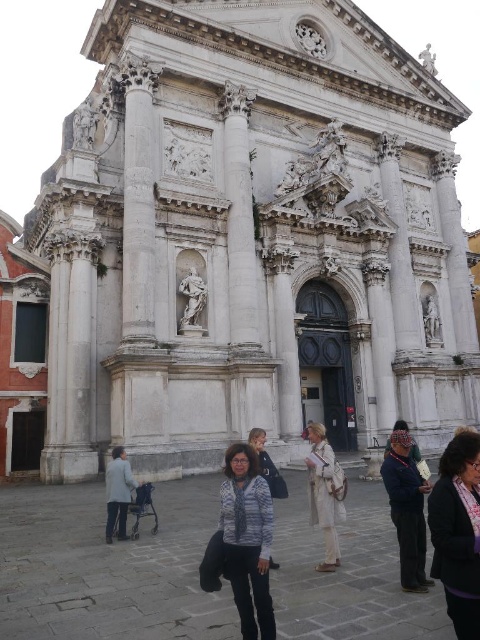
Is white marble column at left positioned behind light gray fabric stroller at lower left?

Yes, white marble column at left is further from the viewer.

Which is above, white marble column at left or light gray fabric stroller at lower left?

white marble column at left

You are a GUI agent. You are given a task and a screenshot of the screen. Output one action in this format:
    pyautogui.click(x=<x>, y=<y>)
    Task: Click on the white marble column at left
    
    Given the screenshot: What is the action you would take?
    pyautogui.click(x=137, y=198)

Is matte black jacket at lower right to the left of striped sweater at center from the viewer's perspective?

No, matte black jacket at lower right is not to the left of striped sweater at center.

Who is positioned more to the left, matte black jacket at lower right or striped sweater at center?

striped sweater at center is more to the left.

This screenshot has width=480, height=640. Describe the element at coordinates (457, 531) in the screenshot. I see `matte black jacket at lower right` at that location.

The height and width of the screenshot is (640, 480). What are the coordinates of `matte black jacket at lower right` in the screenshot? It's located at (457, 531).

Which is above, light gray fabric stroller at lower left or dark blue fabric jacket at center?

Positioned higher is dark blue fabric jacket at center.

Who is more forward, [124,524] or [403,420]?

Positioned in front is point [124,524].

You are a GUI agent. You are given a task and a screenshot of the screen. Output one action in this format:
    pyautogui.click(x=<x>, y=<y>)
    Task: Click on the light gray fabric stroller at lower left
    The width and height of the screenshot is (480, 640).
    Given the screenshot: What is the action you would take?
    pyautogui.click(x=118, y=492)